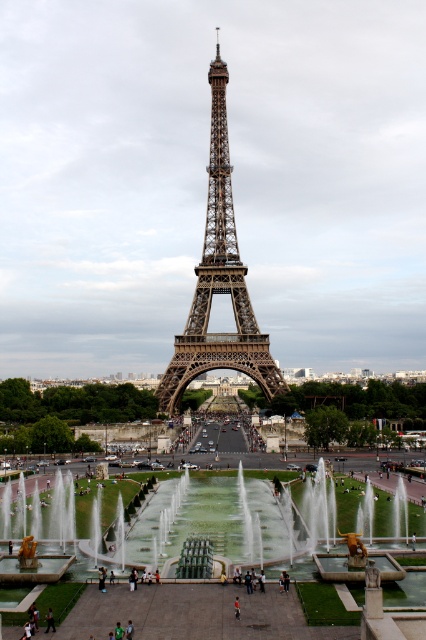
Question: Is brown metal eiffel tower at center above dark blue jeans at center?

Choices:
 (A) no
 (B) yes

Answer: (B)

Question: Which of the following is the farthest from the observer?

Choices:
 (A) brown metal eiffel tower at center
 (B) dark blue jeans at center

Answer: (B)

Question: Does brown metal eiffel tower at center appear on the left side of dark blue jeans at center?

Choices:
 (A) yes
 (B) no

Answer: (B)

Question: Which object appears closest to the camera in this image?

Choices:
 (A) brown metal eiffel tower at center
 (B) dark blue jeans at center

Answer: (A)

Question: Observing the image, what is the correct spatial positioning of brown metal eiffel tower at center in reference to dark blue jeans at center?

Choices:
 (A) above
 (B) below

Answer: (A)